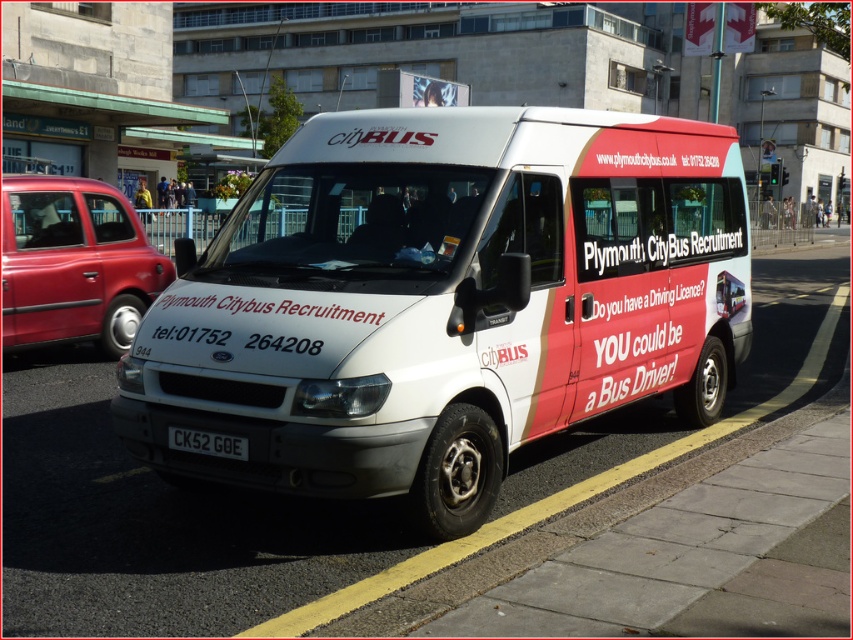
Does metallic red taxi at left appear on the right side of yellow painted curb at lower center?

Incorrect, metallic red taxi at left is not on the right side of yellow painted curb at lower center.

Does point (67, 285) come behind point (686, 449)?

Yes, it is.

Which is in front, point (96, 326) or point (416, 568)?

Point (416, 568) is more forward.

You are a GUI agent. You are given a task and a screenshot of the screen. Output one action in this format:
    pyautogui.click(x=<x>, y=<y>)
    Task: Click on the metallic red taxi at left
    
    Given the screenshot: What is the action you would take?
    pyautogui.click(x=74, y=262)

Which of these two, metallic red taxi at left or black plastic license plate at center, stands shorter?

Standing shorter between the two is black plastic license plate at center.

Is point (105, 241) positioned behind point (195, 451)?

Yes, it is behind point (195, 451).

Is point (9, 224) less distant than point (218, 452)?

No.

Identify the location of metallic red taxi at left. Image resolution: width=853 pixels, height=640 pixels. (74, 262).

From the picture: Who is shorter, white matte van at center or black plastic license plate at center?

black plastic license plate at center is shorter.

Can you confirm if white matte van at center is thinner than black plastic license plate at center?

No, white matte van at center is not thinner than black plastic license plate at center.

Between point (164, 384) and point (200, 448), which one is positioned in front?

Positioned in front is point (200, 448).

The width and height of the screenshot is (853, 640). Find the location of `white matte van at center`. white matte van at center is located at coordinates (445, 301).